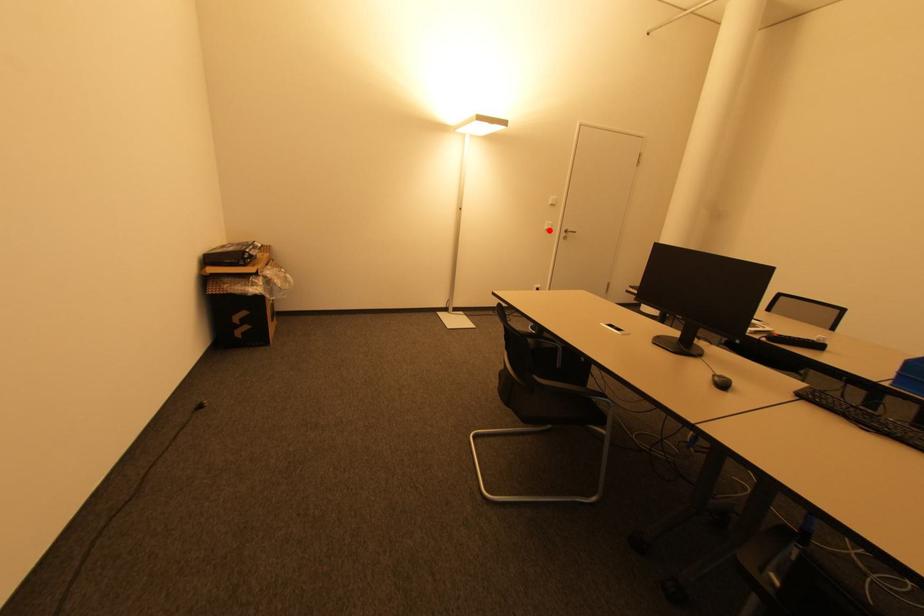
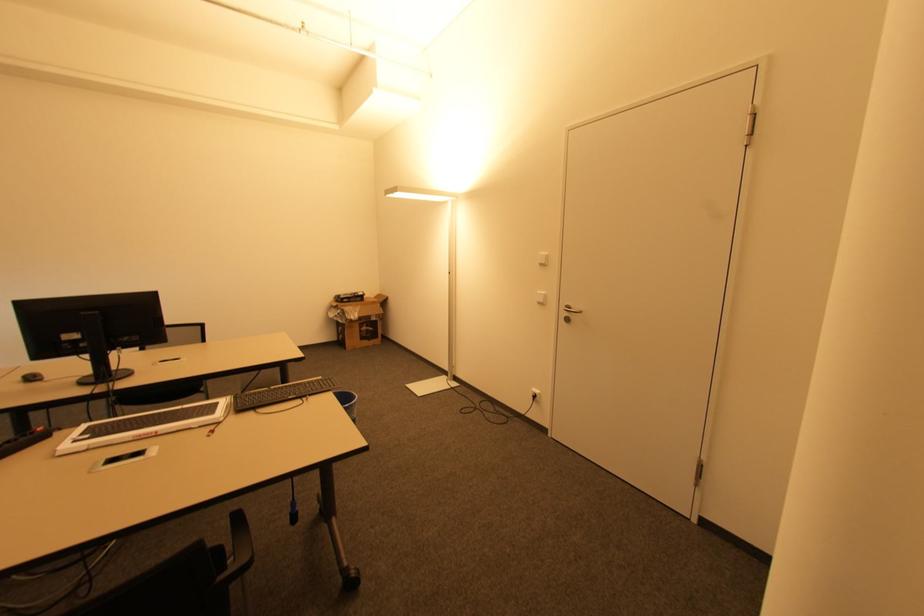
Where in the second image is the point corresponding to the highlighted location from the first image?

(541, 302)